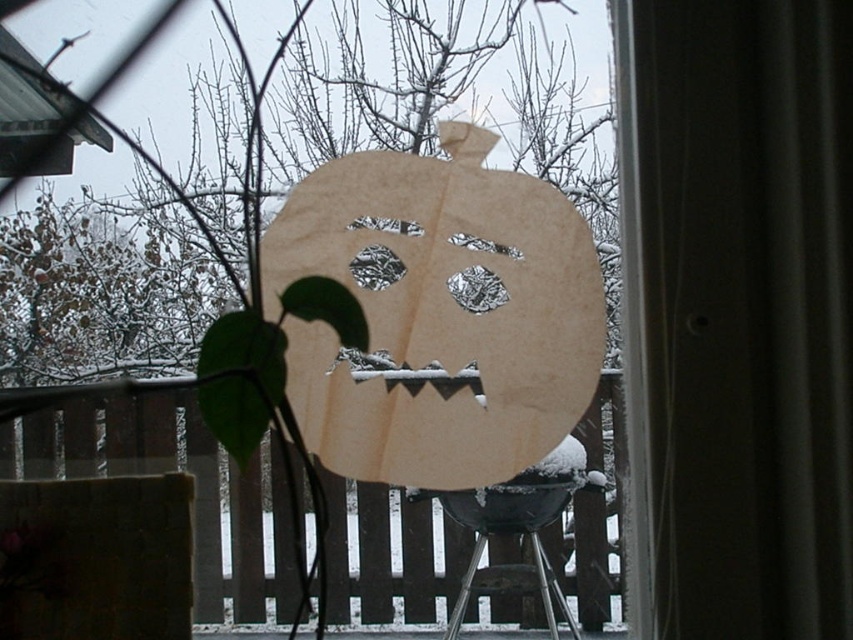
You are standing in a room and want to look outside through the window. There is a transparent plastic screen door at center and a metallic stool at lower center. Which object should you move to have a clearer view of the snowy landscape outside?

The transparent plastic screen door at center is above the metallic stool at lower center. To have a clearer view of the snowy landscape outside, you should move the metallic stool at lower center because it is below the screen door and might be blocking your line of sight.

You are standing in front of a window with a paper pumpkin cutout. You want to place a small decoration exactly at the point marked as point (764, 189) on the window. If your hand can reach up to 85 centimeters from where you are standing, will you be able to reach that point?

The distance between the point (764, 189) and the viewer is 87.40 centimeters. Since your hand can only reach up to 85 centimeters, you will not be able to reach the point (764, 189) on the window.